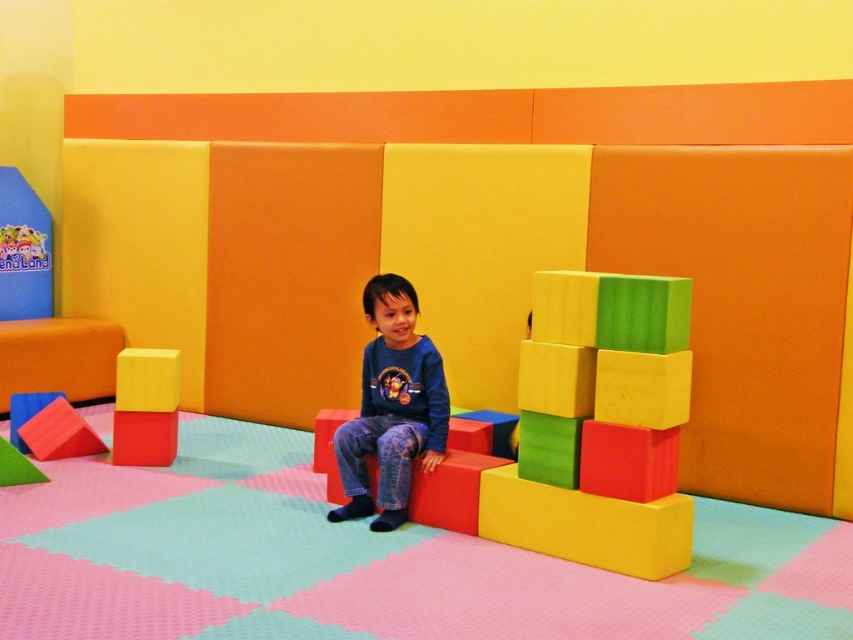
You are a parent trying to build a tower with your child. You have the rubber foam blocks at center and the matte yellow foam block at center. Which block should you choose if you want to build a taller tower?

You should choose the rubber foam blocks at center because they are larger in size compared to the matte yellow foam block at center, allowing for a taller tower.

You are a child trying to place the matte yellow foam block at center on top of the blue cotton shirt at center. Will the block fit entirely on the shirt without hanging over the edges?

The blue cotton shirt at center is wider than the matte yellow foam block at center, so the block will fit entirely on the shirt without hanging over the edges.

You are a parent trying to build a tower with your child. You have two types of blocks available in the play area. The rubber foam blocks at center and the matte yellow foam block at center. Which block type would you choose to build a taller tower if you want it to be much taller?

The rubber foam blocks at center are much taller than the matte yellow foam block at center, so you should choose the rubber foam blocks at center to build a taller tower.